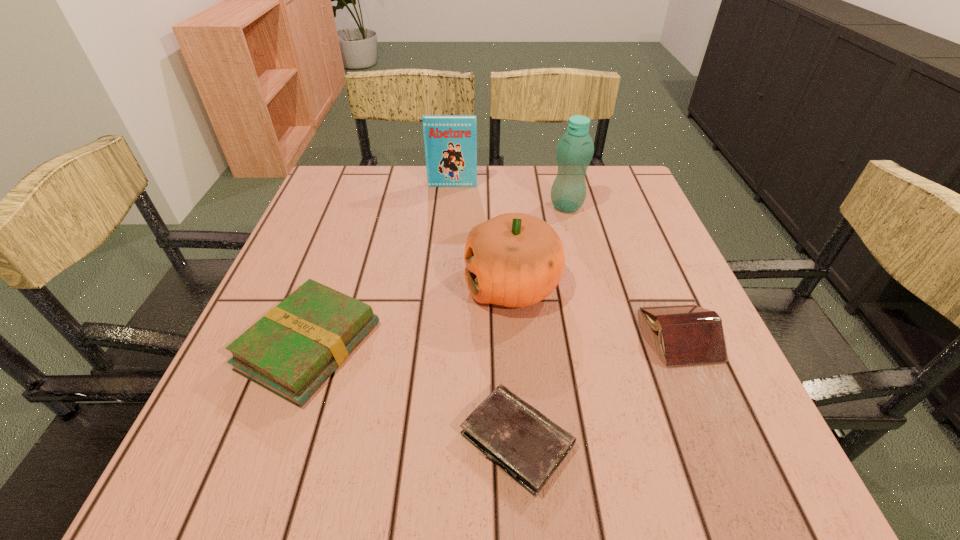
Identify the location of object that is at the near edge. (527, 445).

Locate an element on the screen. object that is at the left edge is located at coordinates (293, 349).

I want to click on object that is at the right edge, so click(x=688, y=334).

This screenshot has width=960, height=540. Find the location of `free space at the far edge of the desktop`. free space at the far edge of the desktop is located at coordinates (393, 198).

The height and width of the screenshot is (540, 960). I want to click on free space at the near edge, so click(x=574, y=478).

You are a GUI agent. You are given a task and a screenshot of the screen. Output one action in this format:
    pyautogui.click(x=<x>, y=<y>)
    Task: Click on the free region at the right edge
    
    Given the screenshot: What is the action you would take?
    pyautogui.click(x=752, y=418)

At what (x,y) coordinates should I click in order to perform the action: click on free region at the far left corner of the desktop. Please return your answer as a coordinate pair (x, y). This screenshot has height=540, width=960. Looking at the image, I should click on (344, 175).

The image size is (960, 540). I want to click on vacant space at the near left corner of the desktop, so click(x=291, y=455).

The width and height of the screenshot is (960, 540). What are the coordinates of `free area in between the leftmost object and the fourth shortest object` in the screenshot? It's located at (411, 316).

Where is `empty space between the shortest object and the farthest book`? The width and height of the screenshot is (960, 540). empty space between the shortest object and the farthest book is located at coordinates (485, 313).